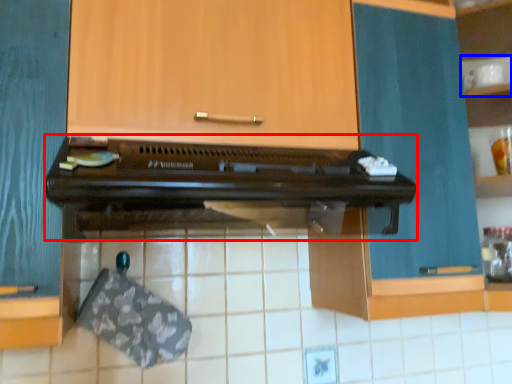
Question: Among these objects, which one is nearest to the camera, oven (highlighted by a red box) or shelf (highlighted by a blue box)?

Choices:
 (A) oven
 (B) shelf

Answer: (A)